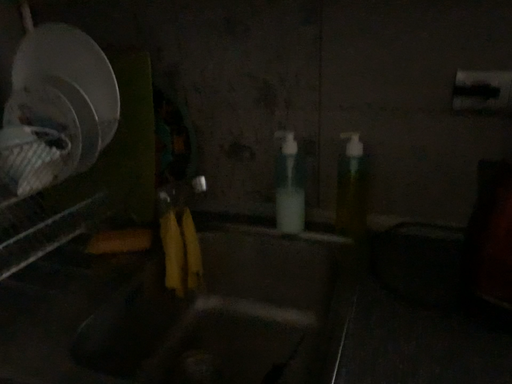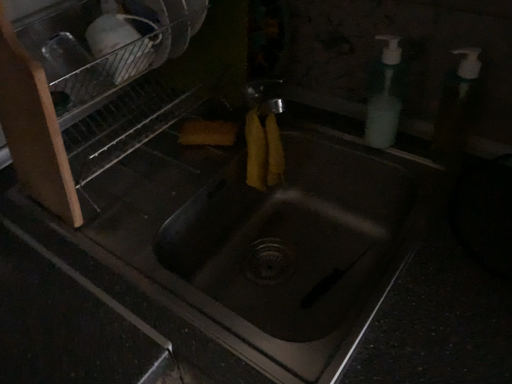
Question: Which way did the camera rotate in the video?

Choices:
 (A) rotated downward
 (B) rotated upward

Answer: (A)